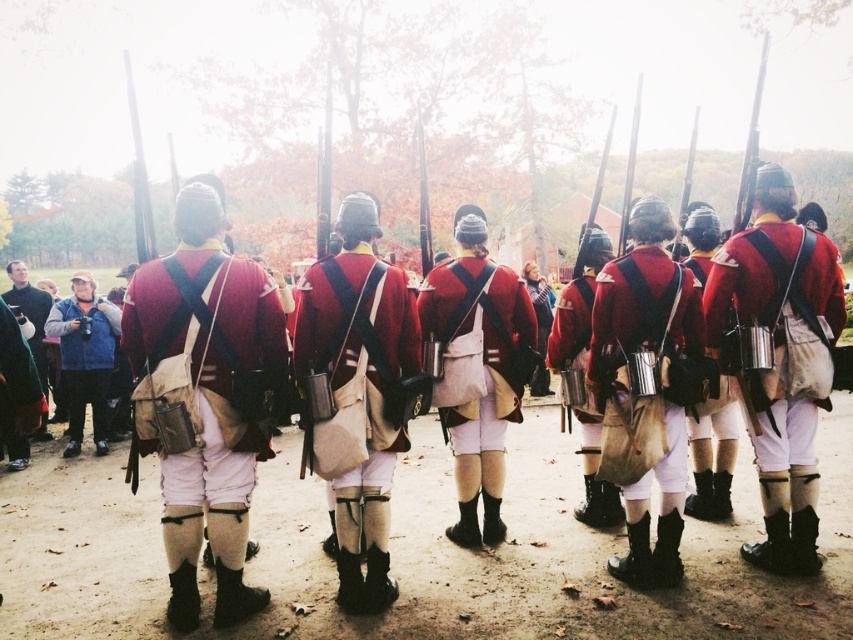
Is matte red fabric uniform at center shorter than matte red uniform at center?

Incorrect, matte red fabric uniform at center's height does not fall short of matte red uniform at center's.

Locate an element on the screen. The image size is (853, 640). matte red fabric uniform at center is located at coordinates point(206,353).

Locate an element on the screen. matte red fabric uniform at center is located at coordinates (206, 353).

Can you confirm if matte red fabric uniform at center is positioned below matte red cloth uniform at center?

Yes, matte red fabric uniform at center is below matte red cloth uniform at center.

Which is behind, point (235, 449) or point (432, 289)?

The point (432, 289) is behind.

At what (x,y) coordinates should I click in order to perform the action: click on matte red fabric uniform at center. Please return your answer as a coordinate pair (x, y). The image size is (853, 640). Looking at the image, I should click on (206, 353).

Does blue fabric vest at left have a smaller size compared to matte leather canteen at center?

No, blue fabric vest at left is not smaller than matte leather canteen at center.

Is blue fabric vest at left to the right of matte leather canteen at center from the viewer's perspective?

No, blue fabric vest at left is not to the right of matte leather canteen at center.

Between point (94, 385) and point (663, 252), which one is positioned in front?

Point (663, 252)

Locate an element on the screen. This screenshot has height=640, width=853. blue fabric vest at left is located at coordinates (85, 356).